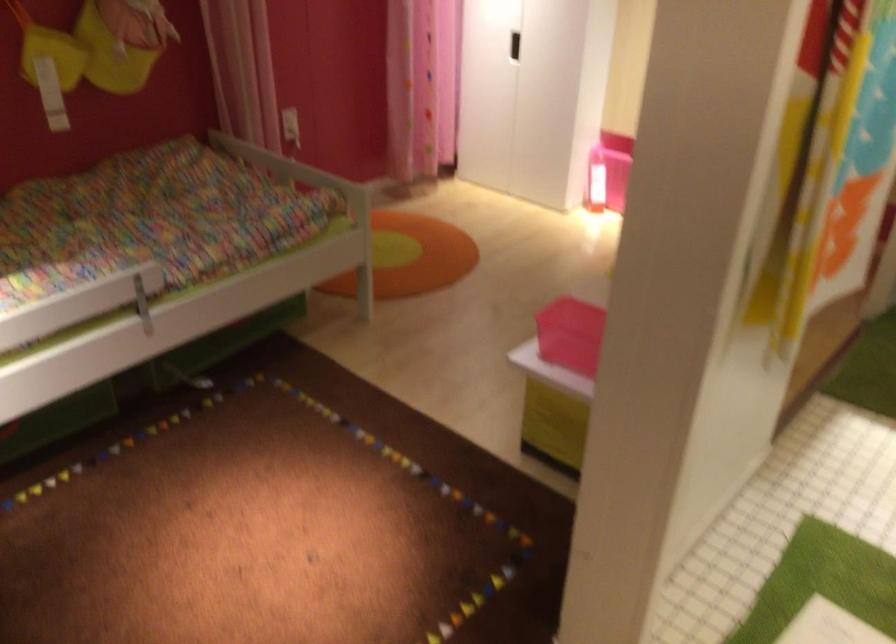
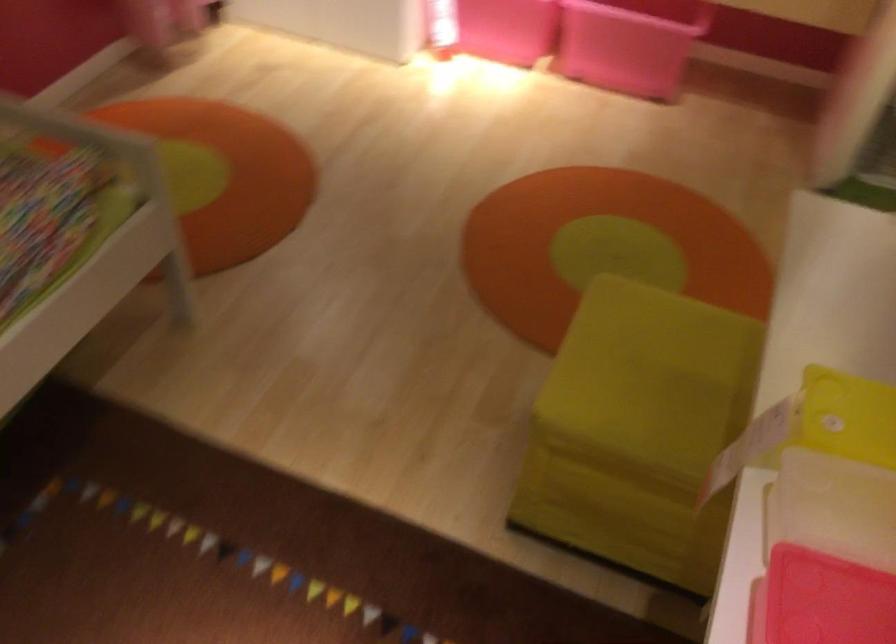
Question: In a continuous first-person perspective shot, in which direction is the camera moving?

Choices:
 (A) Left
 (B) Right
 (C) Forward
 (D) Backward

Answer: (C)